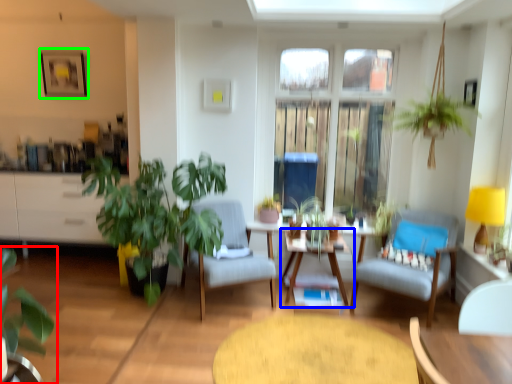
Question: Based on their relative distances, which object is farther from houseplant (highlighted by a red box)? Choose from table (highlighted by a blue box) and picture frame (highlighted by a green box).

Choices:
 (A) table
 (B) picture frame

Answer: (B)